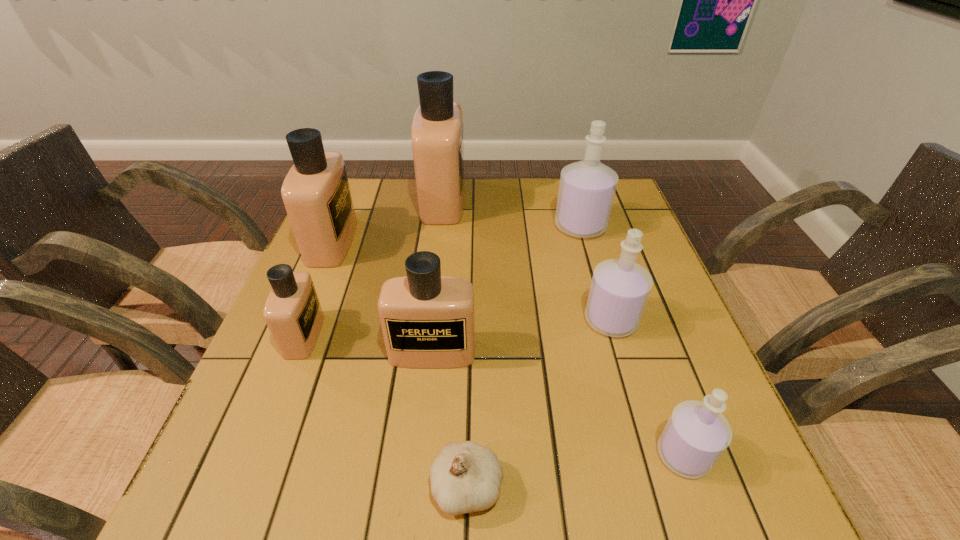
Find the location of a particular element. Image resolution: width=960 pixels, height=540 pixels. the tallest object is located at coordinates (437, 135).

Where is `the biggest beige perfume`? This screenshot has height=540, width=960. the biggest beige perfume is located at coordinates click(437, 135).

Identify the location of the third smallest beige perfume. Image resolution: width=960 pixels, height=540 pixels. (316, 194).

Locate an element on the screen. This screenshot has height=540, width=960. the biggest purple perfume is located at coordinates (587, 188).

Identify the location of the second biggest purple perfume. This screenshot has height=540, width=960. (619, 290).

This screenshot has width=960, height=540. Identify the location of the third biggest beige perfume. (428, 321).

Locate an element on the screen. The width and height of the screenshot is (960, 540). the smallest beige perfume is located at coordinates (292, 312).

This screenshot has height=540, width=960. Find the location of `the smallest purple perfume`. the smallest purple perfume is located at coordinates (696, 435).

Locate an element on the screen. the nearest perfume is located at coordinates (696, 435).

Image resolution: width=960 pixels, height=540 pixels. Find the location of `garlic`. garlic is located at coordinates (466, 477).